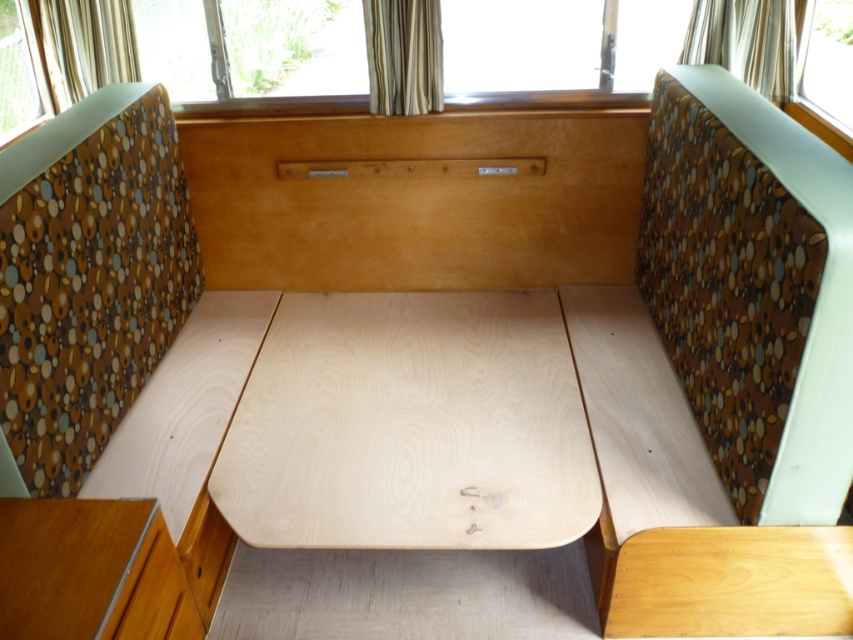
Question: Estimate the real-world distances between objects in this image. Which object is farther from the natural wood table at center?

Choices:
 (A) wooden drawer at lower left
 (B) gold textured curtain at upper right
 (C) striped fabric curtain at upper center

Answer: (B)

Question: Which point is closer to the camera?

Choices:
 (A) striped fabric curtain at upper left
 (B) striped fabric curtain at upper center

Answer: (B)

Question: Does gold textured curtain at upper right come in front of wooden drawer at lower left?

Choices:
 (A) no
 (B) yes

Answer: (A)

Question: From the image, what is the correct spatial relationship of natural wood table at center in relation to transparent glass window at upper right?

Choices:
 (A) below
 (B) above

Answer: (A)

Question: Among these objects, which one is farthest from the camera?

Choices:
 (A) gold textured curtain at upper right
 (B) light wood drawer at lower left
 (C) striped fabric curtain at upper left

Answer: (C)

Question: Can you confirm if gold textured curtain at upper right is thinner than light wood drawer at lower left?

Choices:
 (A) no
 (B) yes

Answer: (A)